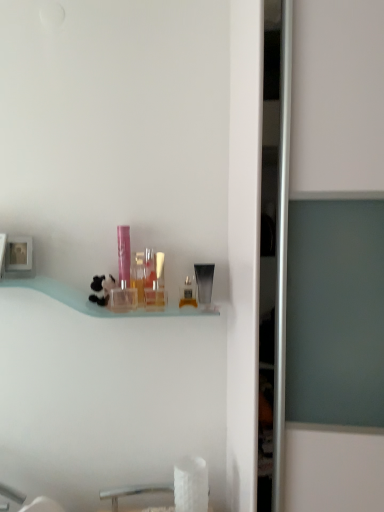
Question: Does pink glossy tube at center, placed as the sixth toiletry when sorted from right to left, have a larger size compared to white ceramic sink at lower center?

Choices:
 (A) no
 (B) yes

Answer: (A)

Question: Is pink glossy tube at center, the first toiletry from the left, positioned before white ceramic sink at lower center?

Choices:
 (A) no
 (B) yes

Answer: (A)

Question: Can you confirm if pink glossy tube at center, the first toiletry from the left, is wider than white ceramic sink at lower center?

Choices:
 (A) yes
 (B) no

Answer: (A)

Question: Is pink glossy tube at center, the first toiletry from the left, turned away from white ceramic sink at lower center?

Choices:
 (A) no
 (B) yes

Answer: (A)

Question: From a real-world perspective, is pink glossy tube at center, placed as the sixth toiletry when sorted from right to left, below white ceramic sink at lower center?

Choices:
 (A) no
 (B) yes

Answer: (A)

Question: Does pink glossy tube at center, placed as the sixth toiletry when sorted from right to left, lie behind white ceramic sink at lower center?

Choices:
 (A) no
 (B) yes

Answer: (B)

Question: Is clear plastic bottle at center, which is counted as the 2th toiletry, starting from the right, a part of white ceramic sink at lower center?

Choices:
 (A) yes
 (B) no

Answer: (B)

Question: Could you tell me if white ceramic sink at lower center is facing clear plastic bottle at center, the 5th toiletry in the left-to-right sequence?

Choices:
 (A) no
 (B) yes

Answer: (A)

Question: From the image's perspective, is white ceramic sink at lower center under clear plastic bottle at center, which is counted as the 2th toiletry, starting from the right?

Choices:
 (A) yes
 (B) no

Answer: (A)

Question: Is the surface of white ceramic sink at lower center in direct contact with clear plastic bottle at center, which is counted as the 2th toiletry, starting from the right?

Choices:
 (A) yes
 (B) no

Answer: (B)

Question: Considering the relative positions of white ceramic sink at lower center and clear plastic bottle at center, the 5th toiletry in the left-to-right sequence, in the image provided, is white ceramic sink at lower center to the left of clear plastic bottle at center, the 5th toiletry in the left-to-right sequence, from the viewer's perspective?

Choices:
 (A) yes
 (B) no

Answer: (A)

Question: Does white ceramic sink at lower center have a lesser width compared to clear plastic bottle at center, the 5th toiletry in the left-to-right sequence?

Choices:
 (A) yes
 (B) no

Answer: (A)

Question: Considering the relative sizes of translucent plastic perfume bottle at center, the 4th toiletry when ordered from left to right, and pink glossy tube at center, placed as the sixth toiletry when sorted from right to left, in the image provided, is translucent plastic perfume bottle at center, the 4th toiletry when ordered from left to right, shorter than pink glossy tube at center, placed as the sixth toiletry when sorted from right to left,?

Choices:
 (A) yes
 (B) no

Answer: (A)